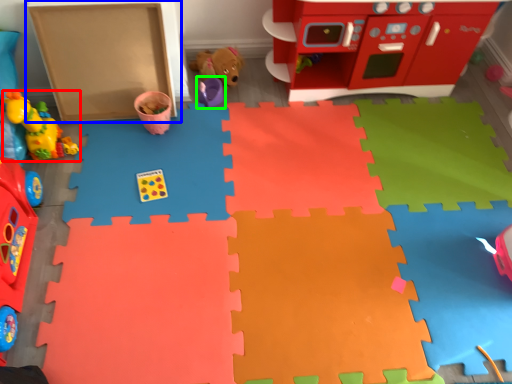
Question: Which object is the farthest from toy (highlighted by a red box)? Choose among these: cardboard box (highlighted by a blue box) or toy (highlighted by a green box).

Choices:
 (A) cardboard box
 (B) toy

Answer: (B)